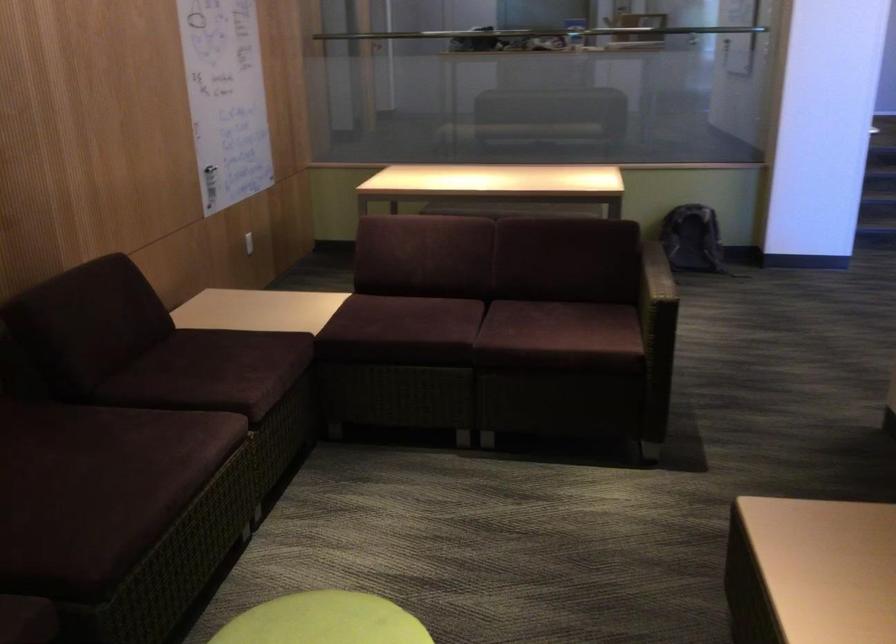
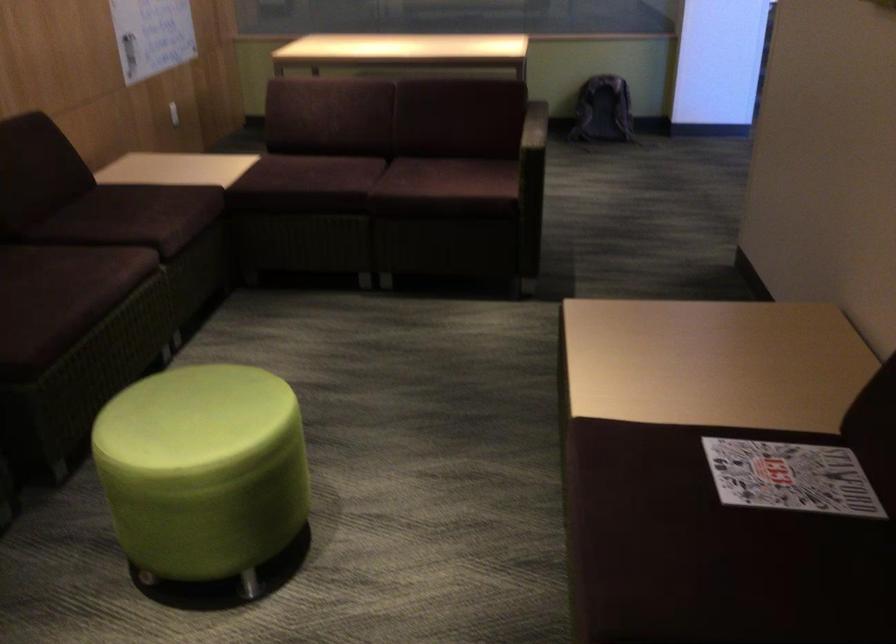
Locate, in the second image, the point that corresponds to (x=694, y=239) in the first image.

(602, 109)